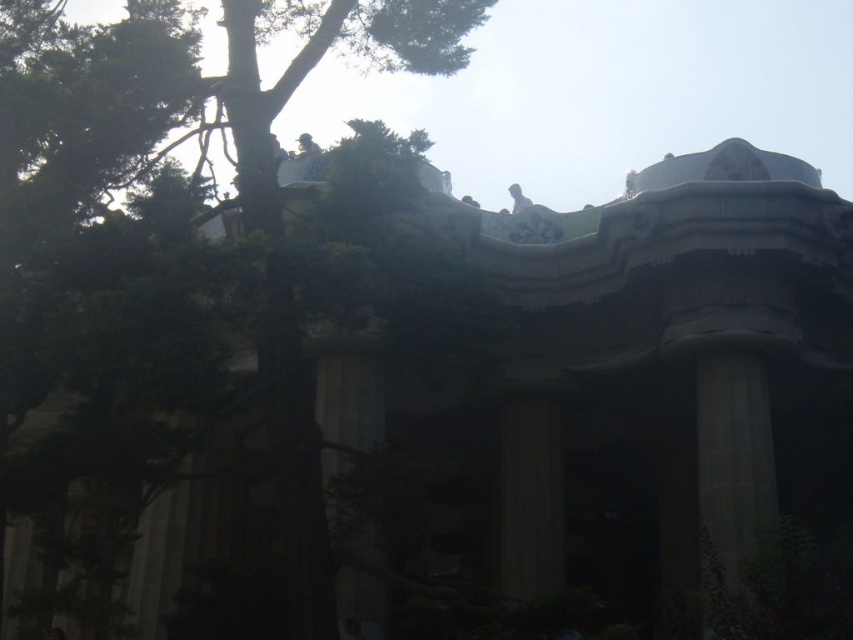
Question: Which of the following is the farthest from the observer?

Choices:
 (A) green leafy tree at upper left
 (B) smooth stone column at center

Answer: (B)

Question: Estimate the real-world distances between objects in this image. Which object is farther from the smooth stone column at center?

Choices:
 (A) light brown wooden statue at upper center
 (B) gray stone column at right

Answer: (A)

Question: Is gray stone column at right smaller than light brown wooden statue at upper center?

Choices:
 (A) no
 (B) yes

Answer: (B)

Question: Does green leafy tree at upper left appear on the right side of smooth stone column at center?

Choices:
 (A) no
 (B) yes

Answer: (A)

Question: Which object is the farthest from the green leafy tree at upper left?

Choices:
 (A) smooth stone column at center
 (B) light brown wooden statue at upper center

Answer: (A)

Question: Does green leafy tree at upper left have a smaller size compared to smooth stone column at center?

Choices:
 (A) no
 (B) yes

Answer: (A)